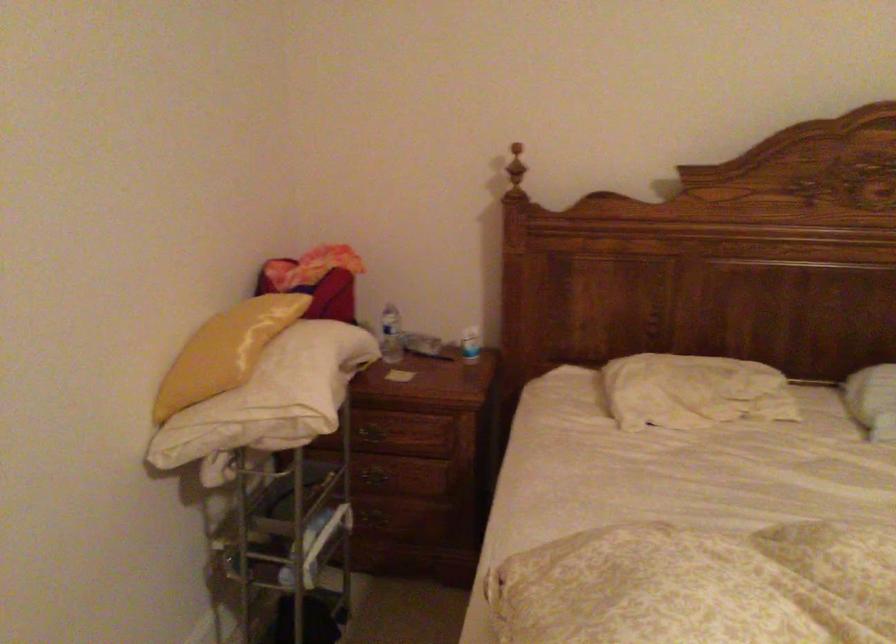
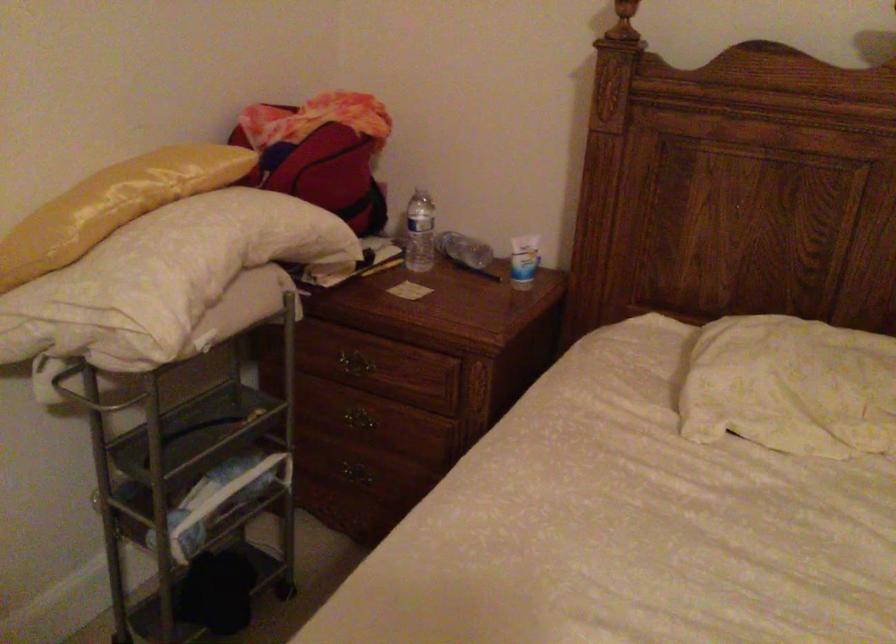
In the second image, find the point that corresponds to pixel 375 520 in the first image.

(355, 473)